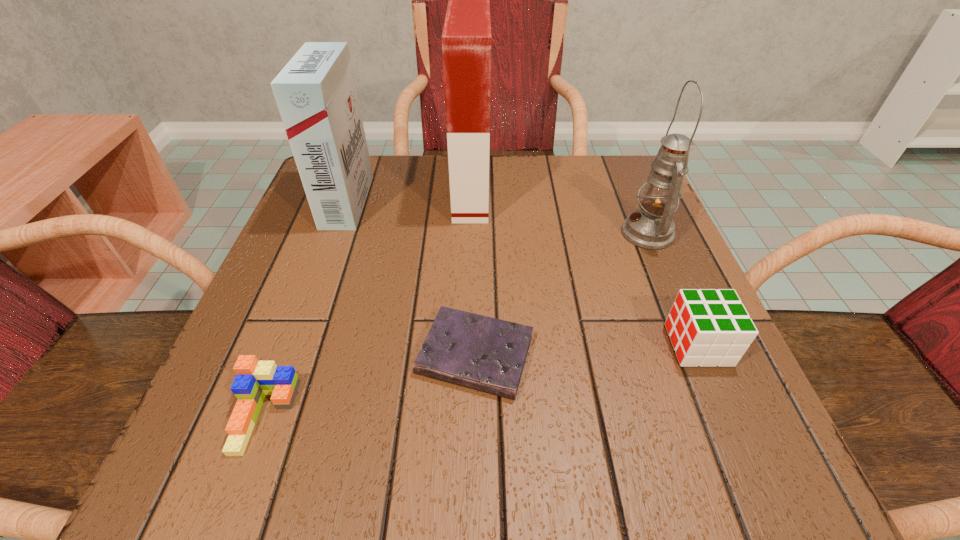
You are a GUI agent. You are given a task and a screenshot of the screen. Output one action in this format:
    pyautogui.click(x=<x>, y=<y>)
    Task: Click on the object located in the far left corner section of the desktop
    
    Given the screenshot: What is the action you would take?
    pyautogui.click(x=316, y=95)

Find the location of `object situated at the near left corner`. object situated at the near left corner is located at coordinates (255, 379).

Find the location of a particular element. object located in the far right corner section of the desktop is located at coordinates (651, 227).

The height and width of the screenshot is (540, 960). What are the coordinates of `vacant space at the far edge` in the screenshot? It's located at (440, 183).

Identify the location of free space at the near edge of the desktop. (321, 451).

The width and height of the screenshot is (960, 540). In order to click on vacant space at the left edge of the desktop in this screenshot , I will do `click(305, 235)`.

Where is `vacant region at the right edge`? The width and height of the screenshot is (960, 540). vacant region at the right edge is located at coordinates (704, 397).

The width and height of the screenshot is (960, 540). What are the coordinates of `free region at the near left corner of the desktop` in the screenshot? It's located at (295, 478).

Locate an element on the screen. This screenshot has width=960, height=540. vacant region at the far right corner of the desktop is located at coordinates (633, 174).

This screenshot has width=960, height=540. I want to click on vacant space that is in between the shorter cigarette case and the fifth tallest object, so click(306, 309).